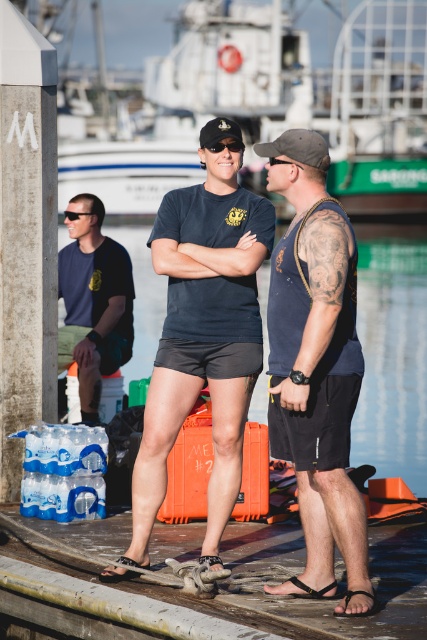
Which is below, dark blue tank top at center or black matte goggles at center?

dark blue tank top at center is lower down.

Is dark blue tank top at center bigger than black matte goggles at center?

Yes, dark blue tank top at center is bigger than black matte goggles at center.

At what (x,y) coordinates should I click in order to perform the action: click on dark blue tank top at center. Please return your answer as a coordinate pair (x, y). The height and width of the screenshot is (640, 427). Looking at the image, I should click on (315, 369).

Does black matte baseball cap at center appear on the left side of black reflective sunglasses at center?

Yes, black matte baseball cap at center is to the left of black reflective sunglasses at center.

Measure the distance between point (225, 128) and camera.

A distance of 49.75 feet exists between point (225, 128) and camera.

I want to click on black matte baseball cap at center, so click(x=219, y=131).

Is matte navy t-shirt at center smaller than wooden at center?

No.

This screenshot has height=640, width=427. I want to click on matte navy t-shirt at center, so click(202, 339).